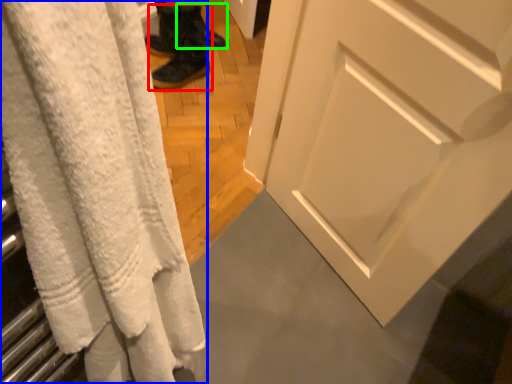
Question: Which object is the closest to the footwear (highlighted by a red box)? Choose among these: curtain (highlighted by a blue box) or footwear (highlighted by a green box).

Choices:
 (A) curtain
 (B) footwear

Answer: (B)